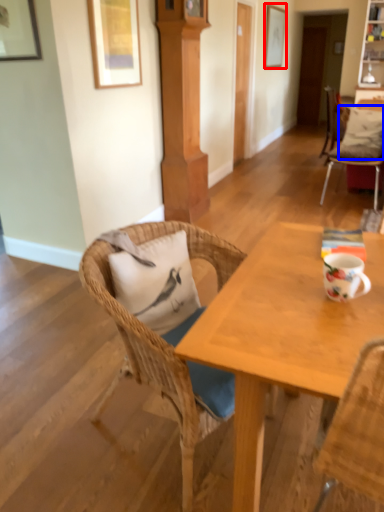
Question: Which of the following is the farthest to the observer, picture frame (highlighted by a red box) or pillow (highlighted by a blue box)?

Choices:
 (A) picture frame
 (B) pillow

Answer: (A)